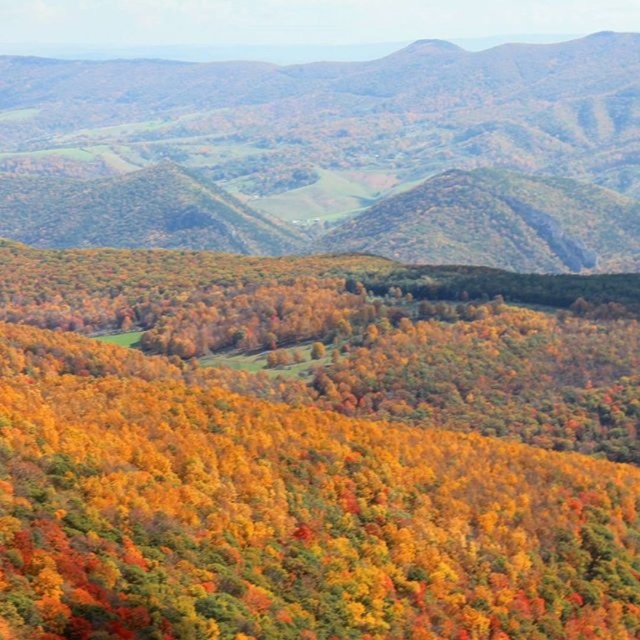
Which is above, autumn leaves forest at center or green leafy forest at center?

green leafy forest at center is above.

This screenshot has height=640, width=640. Find the location of `autumn leaves forest at center`. autumn leaves forest at center is located at coordinates (312, 451).

Find the location of a particular element. This screenshot has width=640, height=640. autumn leaves forest at center is located at coordinates pos(312,451).